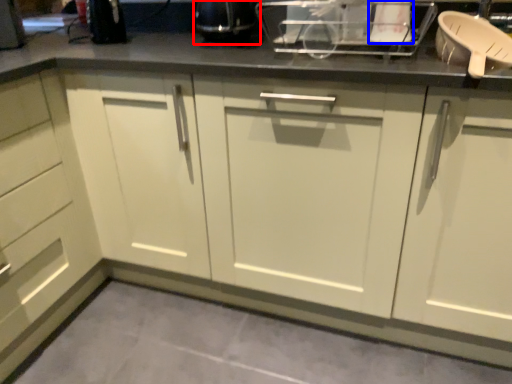
Question: Among these objects, which one is nearest to the camera, appliance (highlighted by a red box) or appliance (highlighted by a blue box)?

Choices:
 (A) appliance
 (B) appliance

Answer: (B)